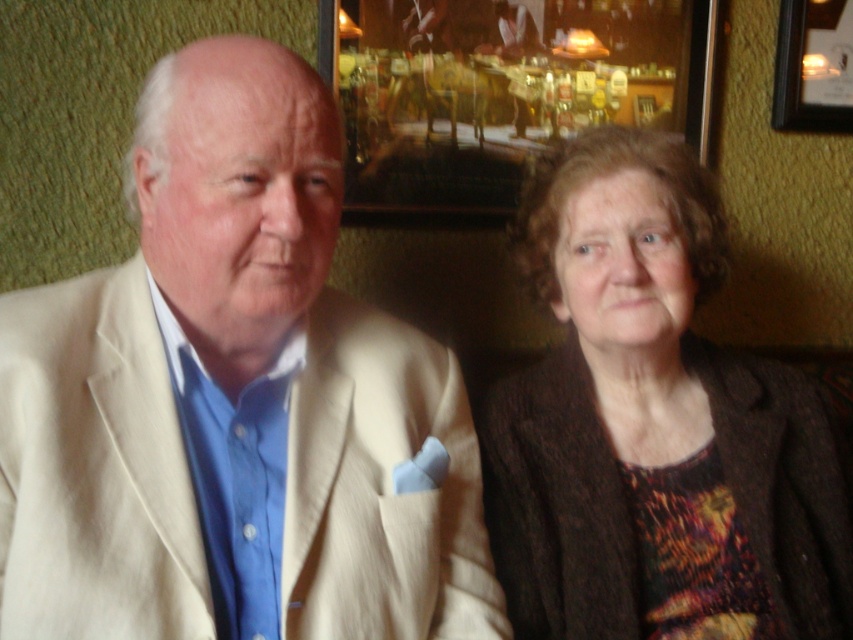
You are a photographer setting up for a group photo. You need to arrange the beige fabric suit at left and the brown textured sweater at right so that both fit within a 1.2 meter wide frame. Given their widths, will the total width of both items exceed the frame?

The beige fabric suit at left is narrower than the brown textured sweater at right. Adding both widths together may exceed 1.2 meters, but since exact measurements aren

Based on the photo, you are a photographer trying to capture a portrait of the two people in the scene. You want to ensure that the wooden frame at upper center does not appear in the background. Based on their current positions, where should you position yourself relative to the subjects to avoid the frame?

To avoid the wooden frame at upper center appearing in the background, position yourself to the left or right of the subjects, as the frame is centrally located at point (500, 92). This way, the frame will be out of the camera frame.

You are a photographer adjusting the camera settings to focus on the beige fabric suit at left. What are the coordinates you should set to ensure the focus point is accurate?

The coordinates to focus on the beige fabric suit at left should be set to point (234, 401).